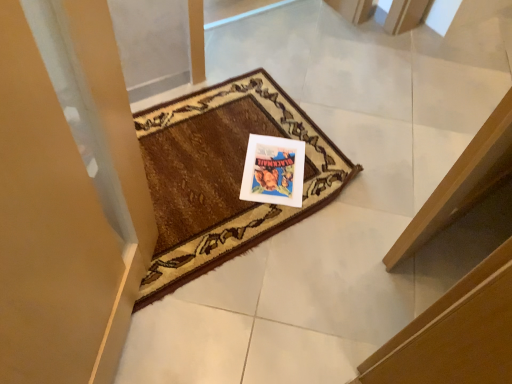
Question: Is point (231, 213) closer or farther from the camera than point (285, 162)?

Choices:
 (A) farther
 (B) closer

Answer: (B)

Question: In terms of height, does brown woven mat at center look taller or shorter compared to white glossy picture frame at center?

Choices:
 (A) tall
 (B) short

Answer: (A)

Question: Considering the positions of brown woven mat at center and white glossy picture frame at center in the image, is brown woven mat at center bigger or smaller than white glossy picture frame at center?

Choices:
 (A) big
 (B) small

Answer: (A)

Question: From a real-world perspective, relative to brown woven mat at center, is white glossy picture frame at center vertically above or below?

Choices:
 (A) below
 (B) above

Answer: (A)

Question: Relative to brown woven mat at center, is white glossy picture frame at center in front or behind?

Choices:
 (A) front
 (B) behind

Answer: (B)

Question: Looking at the image, does white glossy picture frame at center seem bigger or smaller compared to brown woven mat at center?

Choices:
 (A) small
 (B) big

Answer: (A)

Question: Is point (259, 200) positioned closer to the camera than point (312, 139)?

Choices:
 (A) farther
 (B) closer

Answer: (B)